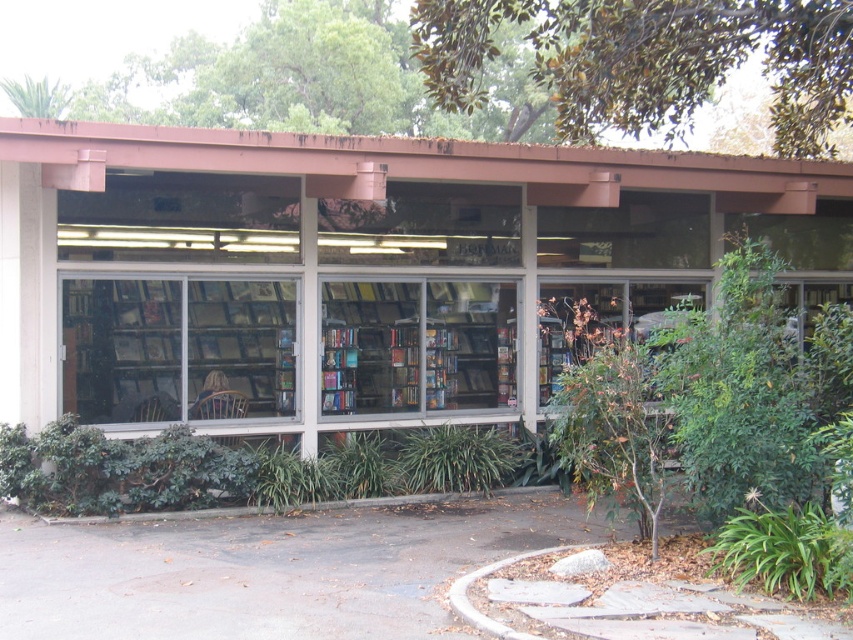
Question: Which point is farther to the camera?

Choices:
 (A) green leafy bush at center
 (B) clear glass bookshelf at center
 (C) wooden bookshelf at center

Answer: (B)

Question: Is wooden bookshelf at center closer to camera compared to green leafy bush at center?

Choices:
 (A) no
 (B) yes

Answer: (B)

Question: Does clear glass bookshelf at center appear on the left side of wooden bookshelf at center?

Choices:
 (A) no
 (B) yes

Answer: (B)

Question: Can you confirm if wooden bookshelf at center is positioned to the right of green leafy bush at center?

Choices:
 (A) yes
 (B) no

Answer: (B)

Question: Which object is farther from the camera taking this photo?

Choices:
 (A) clear glass windows at center
 (B) wooden bookshelf at center
 (C) clear glass bookshelf at center
 (D) green leafy bush at center

Answer: (C)

Question: Which point is closer to the camera taking this photo?

Choices:
 (A) (634, 323)
 (B) (299, 285)
 (C) (450, 282)
 (D) (358, 323)

Answer: (B)